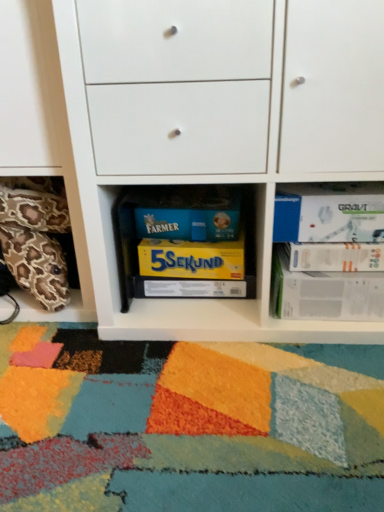
Question: From a real-world perspective, relative to yellow matte board game at center, which is counted as the third paperback book, starting from the top, is yellow cardboard box at center, arranged as the 1th paperback book when ordered from the bottom, vertically above or below?

Choices:
 (A) above
 (B) below

Answer: (B)

Question: Is yellow cardboard box at center, arranged as the 1th paperback book when ordered from the bottom, inside or outside of yellow matte board game at center, which is counted as the third paperback book, starting from the top?

Choices:
 (A) outside
 (B) inside

Answer: (A)

Question: Based on their relative distances, which object is nearer to the white paper at right, the 2th paperback book in the bottom-to-top sequence?

Choices:
 (A) white paper at right, acting as the second paperback book starting from the top
 (B) leopard print pillow at lower left
 (C) white matte paperback book at upper right, the first paperback book in the top-to-bottom sequence
 (D) yellow matte board game at center, which is counted as the third paperback book, starting from the top
 (E) white matte cabinet at center

Answer: (A)

Question: Which object is positioned closest to the yellow matte board game at center, which is counted as the third paperback book, starting from the top?

Choices:
 (A) white matte cabinet at center
 (B) white paper at right, the fourth paperback book from the bottom
 (C) white paper at right, the fourth paperback book viewed from the top
 (D) leopard print pillow at lower left
 (E) yellow cardboard box at center, the 5th paperback book positioned from the top

Answer: (E)